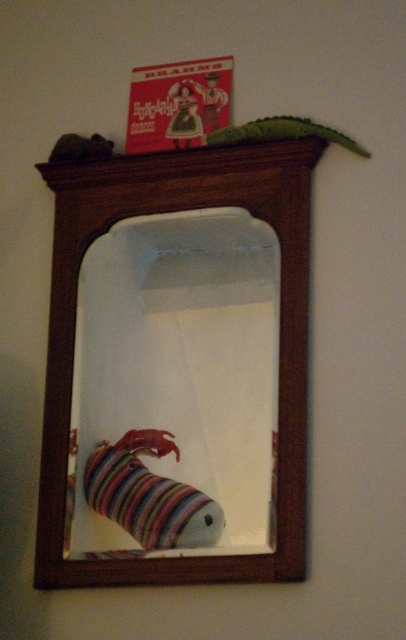
You are a delivery person who just arrived at a house to deliver a package. You need to place the package on the surface between the wooden mirror at upper center and the velvet plush toy at upper left. The package is 15 inches long. Will it fit between them?

The wooden mirror at upper center and the velvet plush toy at upper left are 15.22 inches apart from each other. Since the package is 15 inches long, it will fit between them as the space is slightly larger than the package.

You are standing in a room and want to adjust the wooden mirror at upper center so that it is closer to you. How much distance do you need to move it towards yourself to make it 3.5 feet away?

The wooden mirror at upper center is currently 4.08 feet away. To make it 3.5 feet away, you need to move it closer by 0.58 feet.

You are an interior designer arranging items on a shelf. You have the wooden mirror at upper center and the matte plastic cowboy at upper center. Which item is placed above the other?

The matte plastic cowboy at upper center is placed above the wooden mirror at upper center since the wooden mirror at upper center is positioned under it.